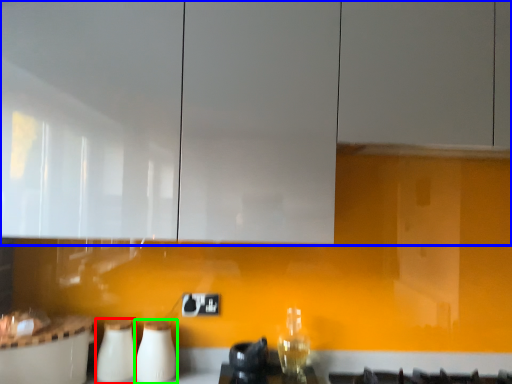
Question: Which object is positioned closest to appliance (highlighted by a red box)? Select from cabinetry (highlighted by a blue box) and appliance (highlighted by a green box).

Choices:
 (A) cabinetry
 (B) appliance

Answer: (B)